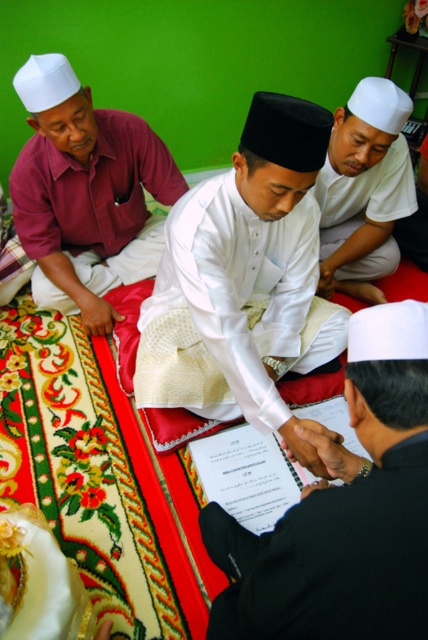
Does matte maroon shirt at left have a lesser height compared to white matte shirt at center?

No.

Does point (59, 118) come in front of point (404, 120)?

Yes, it is.

Is point (65, 72) positioned after point (407, 164)?

No, (65, 72) is closer to viewer.

Where is `matte maroon shirt at left`? Image resolution: width=428 pixels, height=640 pixels. matte maroon shirt at left is located at coordinates point(86,193).

Who is higher up, white satin shirt at center or white matte shirt at center?

white matte shirt at center is above.

This screenshot has width=428, height=640. What do you see at coordinates (249, 262) in the screenshot?
I see `white satin shirt at center` at bounding box center [249, 262].

Between point (270, 179) and point (330, 180), which one is positioned behind?

The point (330, 180) is behind.

The height and width of the screenshot is (640, 428). I want to click on white satin shirt at center, so click(x=249, y=262).

Is black satin robe at lower right smaller than white matte shirt at center?

Yes, black satin robe at lower right is smaller than white matte shirt at center.

Can you confirm if black satin robe at lower right is wider than white matte shirt at center?

No, black satin robe at lower right is not wider than white matte shirt at center.

Measure the distance between point [297,602] and camera.

28.27 inches

Locate an element on the screen. The height and width of the screenshot is (640, 428). black satin robe at lower right is located at coordinates (330, 561).